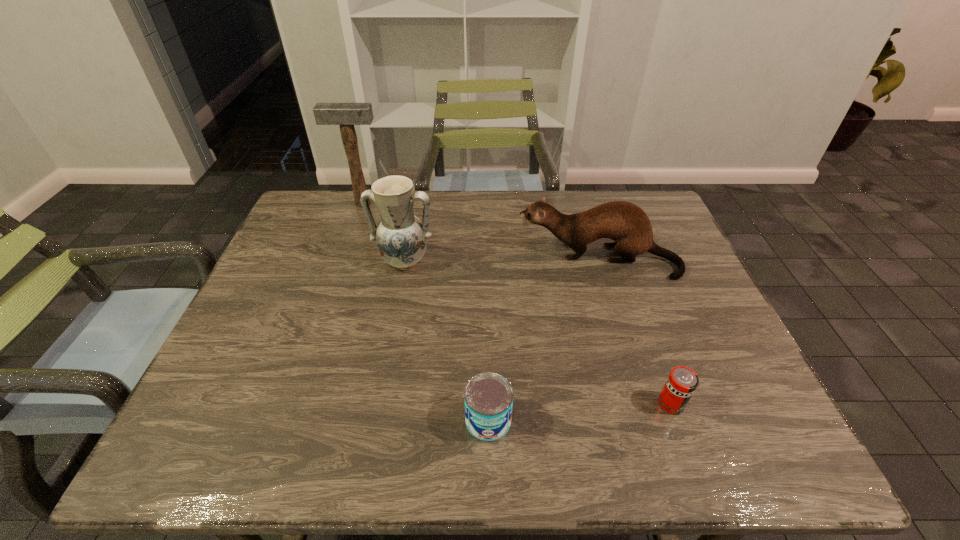
The image size is (960, 540). I want to click on free space at the near edge of the desktop, so click(x=528, y=424).

In the image, there is a desktop. At what (x,y) coordinates should I click in order to perform the action: click on vacant space at the left edge. Please return your answer as a coordinate pair (x, y). Looking at the image, I should click on (234, 362).

This screenshot has width=960, height=540. In the image, there is a desktop. Find the location of `blank space at the right edge`. blank space at the right edge is located at coordinates (654, 261).

You are a GUI agent. You are given a task and a screenshot of the screen. Output one action in this format:
    pyautogui.click(x=<x>, y=<y>)
    Task: Click on the vacant space at the far left corner
    Image resolution: width=960 pixels, height=540 pixels.
    Given the screenshot: What is the action you would take?
    pyautogui.click(x=334, y=223)

Find the location of a particular element. This screenshot has height=540, width=960. vacant area that lies between the third shortest object and the second object from left to right is located at coordinates (501, 260).

I want to click on free space between the left can and the third tallest object, so click(x=543, y=340).

Where is `vacant region between the left can and the ferret`? This screenshot has width=960, height=540. vacant region between the left can and the ferret is located at coordinates (543, 340).

You are a GUI agent. You are given a task and a screenshot of the screen. Output one action in this format:
    pyautogui.click(x=<x>, y=<y>)
    Task: Click on the unoccupied area between the right can and the third tallest object
    The width and height of the screenshot is (960, 540).
    Given the screenshot: What is the action you would take?
    pyautogui.click(x=635, y=332)

Where is `vacant space that's between the third object from left to right and the second tallest object`? vacant space that's between the third object from left to right and the second tallest object is located at coordinates (446, 341).

I want to click on vacant space that is in between the third object from left to right and the right can, so click(580, 412).